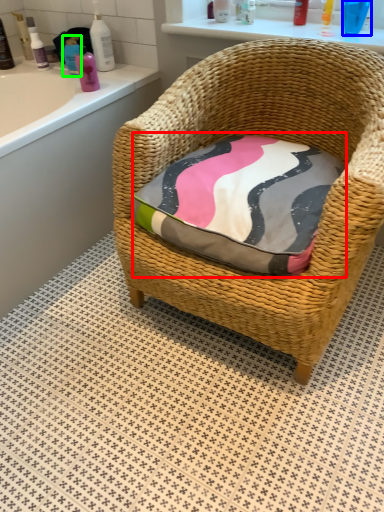
Question: Estimate the real-world distances between objects in this image. Which object is farther from throw pillow (highlighted by a red box), toiletry (highlighted by a blue box) or toiletry (highlighted by a green box)?

Choices:
 (A) toiletry
 (B) toiletry

Answer: (B)